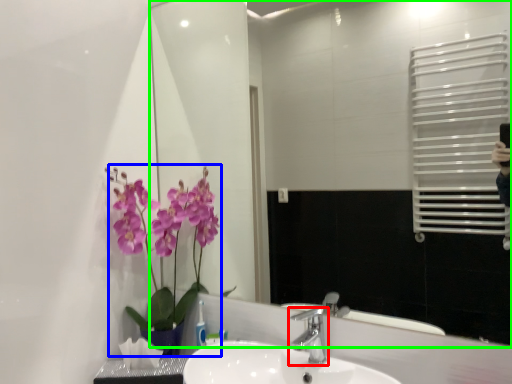
Question: Estimate the real-world distances between objects in this image. Which object is closer to tap (highlighted by a red box), floral arrangement (highlighted by a blue box) or mirror (highlighted by a green box)?

Choices:
 (A) floral arrangement
 (B) mirror

Answer: (A)